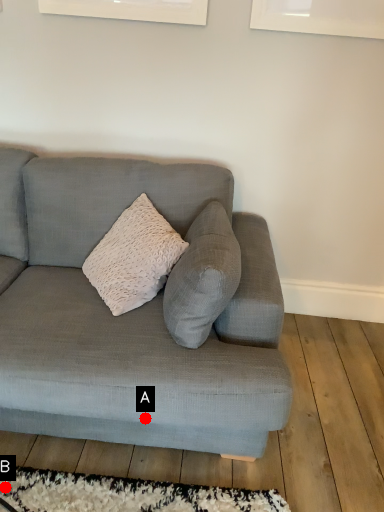
Question: Two points are circled on the image, labeled by A and B beside each circle. Which point appears farthest from the camera in this image?

Choices:
 (A) A is further
 (B) B is further

Answer: (B)